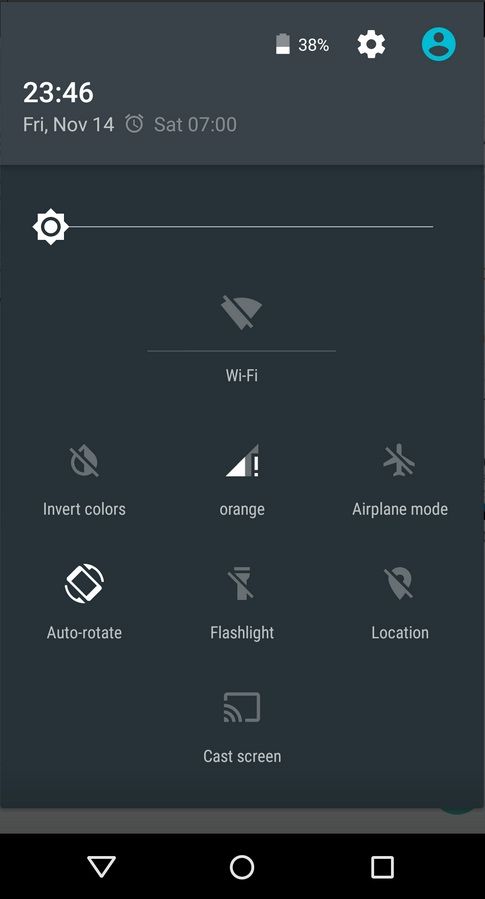
This screenshot has height=899, width=485. In order to click on alarm in this screenshot , I will do `click(137, 125)`.